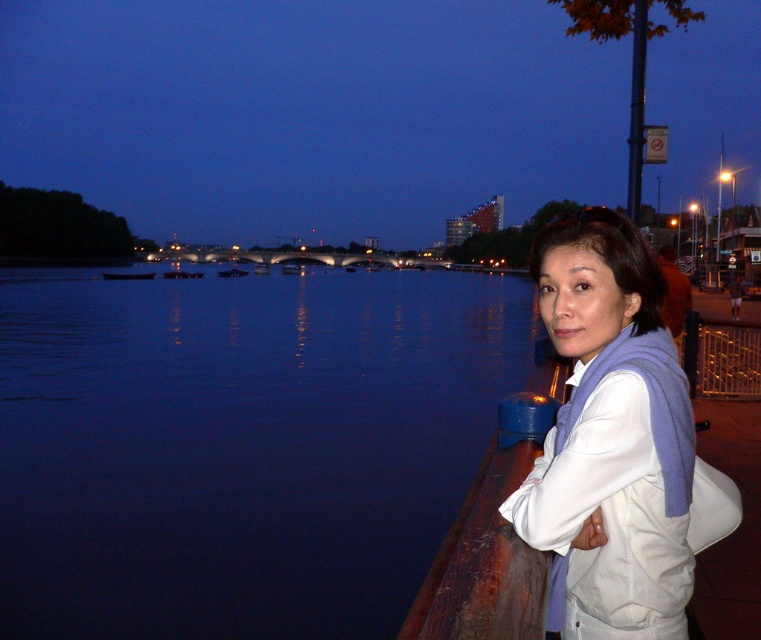
Measure the distance between white matte scarf at right and camera.

white matte scarf at right is 5.49 feet from camera.

Can you confirm if white matte scarf at right is positioned to the right of metallic silver boat at center?

Correct, you'll find white matte scarf at right to the right of metallic silver boat at center.

Identify the location of white matte scarf at right. The image size is (761, 640). (610, 438).

Which is above, blue water at lower left or dark blue wooden boat at center?

dark blue wooden boat at center is above.

Is blue water at lower left below dark blue wooden boat at center?

Yes, blue water at lower left is below dark blue wooden boat at center.

Which is behind, point (161, 339) or point (116, 273)?

The point (116, 273) is behind.

Identify the location of blue water at lower left. The height and width of the screenshot is (640, 761). (240, 445).

Can you confirm if dark blue wooden boat at center is thinner than dark blue fabric boat at center?

Correct, dark blue wooden boat at center's width is less than dark blue fabric boat at center's.

Does point (123, 280) lie in front of point (172, 272)?

Yes, point (123, 280) is closer to viewer.

Find the location of a particular element. dark blue wooden boat at center is located at coordinates (126, 275).